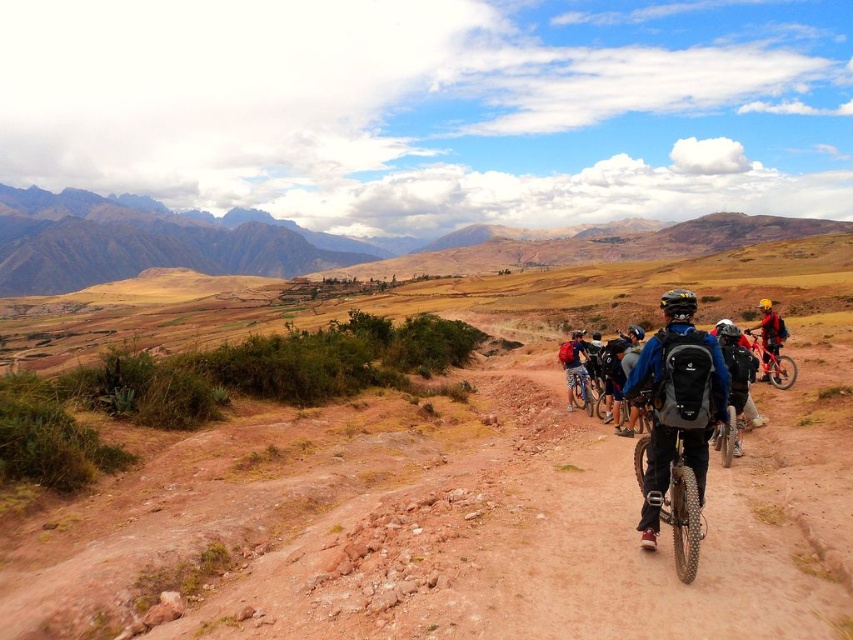
Question: Estimate the real-world distances between objects in this image. Which object is farther from the rugged brown mountains at upper left?

Choices:
 (A) matte black backpack at center
 (B) matte black bicycle at center

Answer: (A)

Question: Is rugged brown mountains at upper left to the left of matte black bicycle at center from the viewer's perspective?

Choices:
 (A) no
 (B) yes

Answer: (B)

Question: From the image, what is the correct spatial relationship of matte black backpack at center in relation to shiny red mountain bike at right?

Choices:
 (A) below
 (B) above

Answer: (A)

Question: Which object is the closest to the matte black bicycle at center?

Choices:
 (A) red matte bicycle at right
 (B) shiny red mountain bike at right

Answer: (B)

Question: Can you confirm if matte black backpack at center is positioned to the right of matte black bicycle at center?

Choices:
 (A) yes
 (B) no

Answer: (A)

Question: Which object appears farthest from the camera in this image?

Choices:
 (A) rugged brown mountains at upper left
 (B) red matte bicycle at right

Answer: (A)